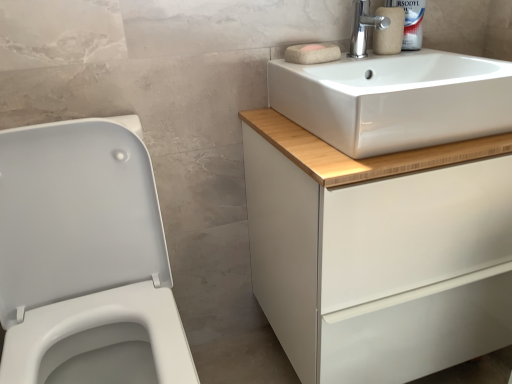
Question: In terms of width, does white glossy plastic bottle at upper right look wider or thinner when compared to white matte soap at upper center, acting as the 1th soap starting from the back?

Choices:
 (A) wide
 (B) thin

Answer: (A)

Question: From the image's perspective, relative to white matte soap at upper center, which is the 2th soap from front to back, is white glossy plastic bottle at upper right above or below?

Choices:
 (A) below
 (B) above

Answer: (B)

Question: Estimate the real-world distances between objects in this image. Which object is closer to the white ceramic sink at upper right?

Choices:
 (A) white matte soap at upper center, which is the 2th soap from front to back
 (B) matte beige toilet paper at upper right
 (C) white matte cabinet at upper right
 (D) white glossy porcelain at left
 (E) natural wool soap at upper center, which ranks as the 2th soap in back-to-front order

Answer: (E)

Question: Based on their relative distances, which object is nearer to the natural wool soap at upper center, positioned as the 1th soap in front-to-back order?

Choices:
 (A) polished chrome tap at upper right
 (B) white matte soap at upper center, acting as the 1th soap starting from the back
 (C) white ceramic sink at upper right
 (D) matte beige toilet paper at upper right
 (E) white glossy plastic bottle at upper right

Answer: (B)